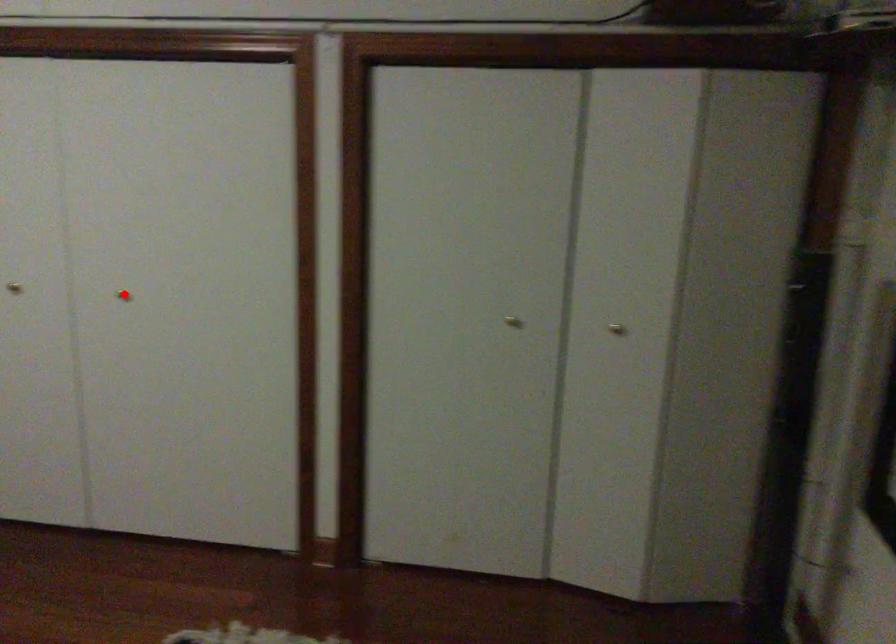
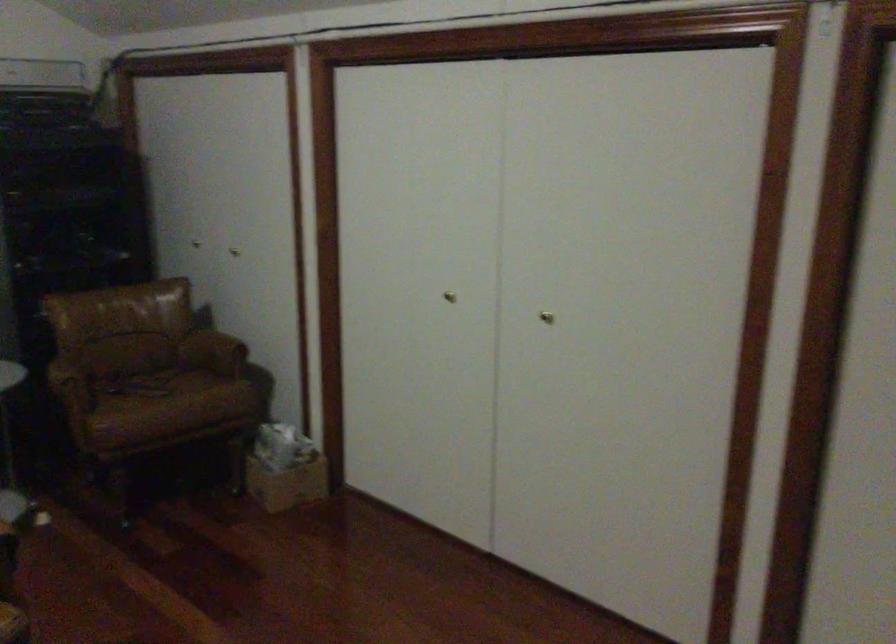
Find the pixel in the second image that matches the highlighted location in the first image.

(546, 317)